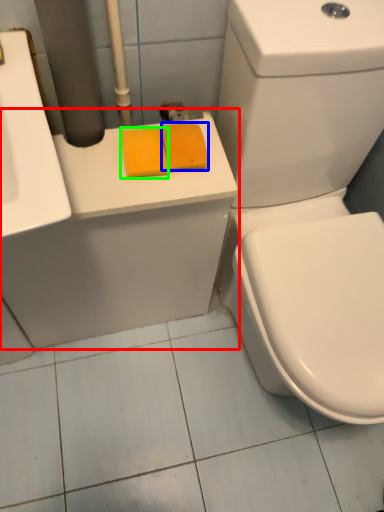
Question: Which is nearer to the counter top (highlighted by a red box)? soap (highlighted by a blue box) or soap (highlighted by a green box).

Choices:
 (A) soap
 (B) soap

Answer: (B)